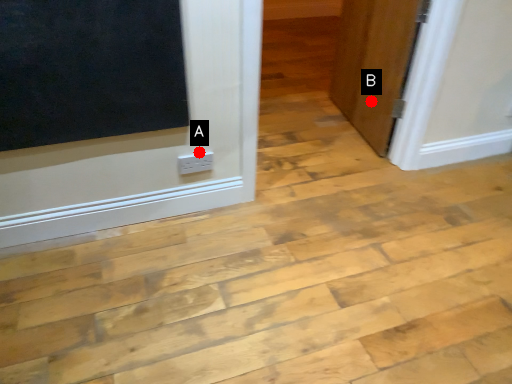
Question: Two points are circled on the image, labeled by A and B beside each circle. Which point is further to the camera?

Choices:
 (A) A is further
 (B) B is further

Answer: (B)